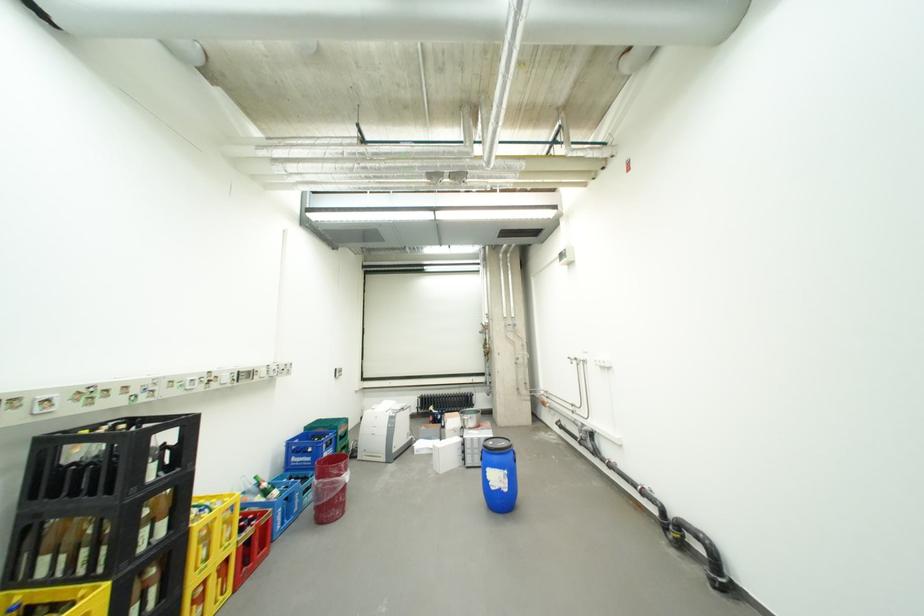
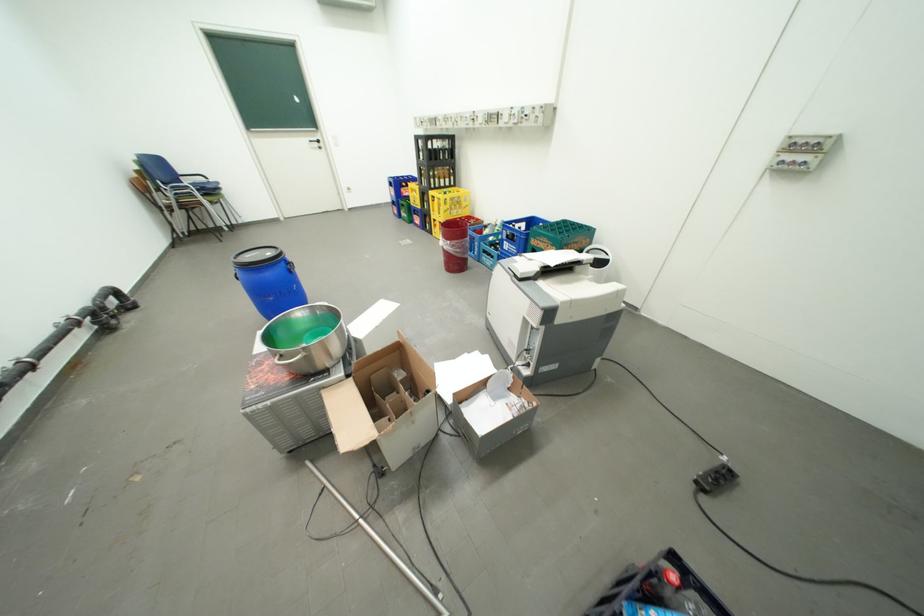
Where in the second image is the point corresponding to (x=334, y=455) from the first image?

(516, 244)